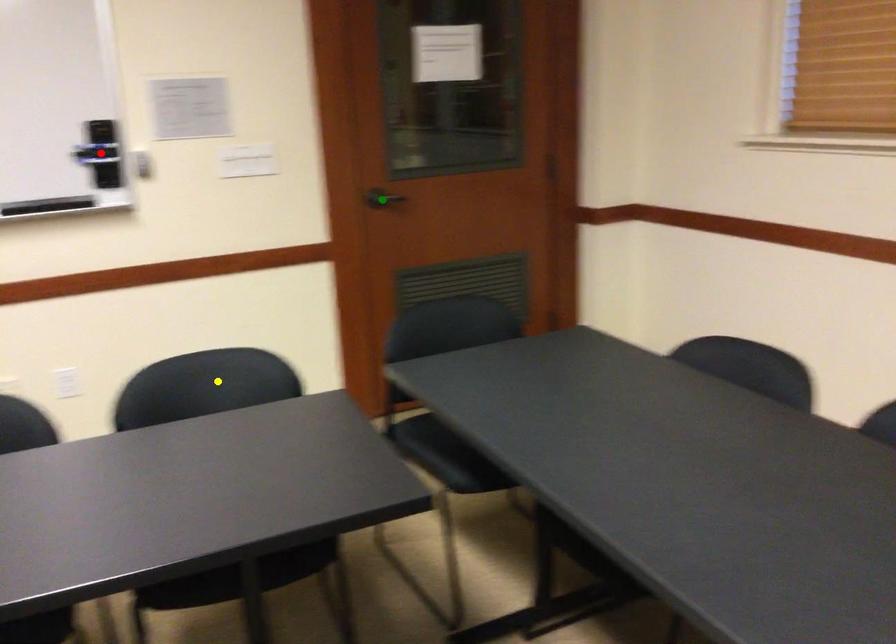
Order these from farthest to nearest:
1. green point
2. red point
3. yellow point

green point
red point
yellow point